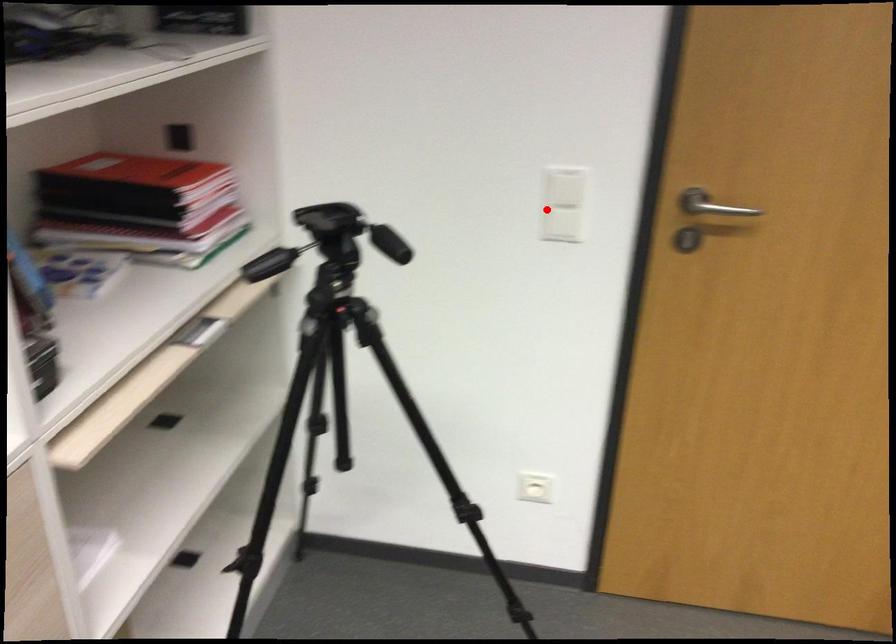
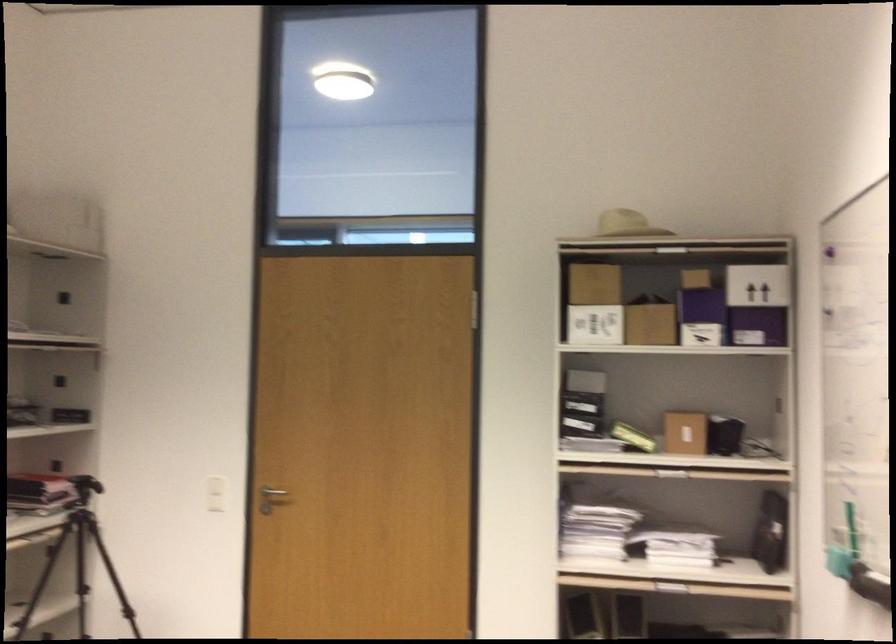
Locate, in the second image, the point that corresponds to the highlighted location in the first image.

(216, 494)